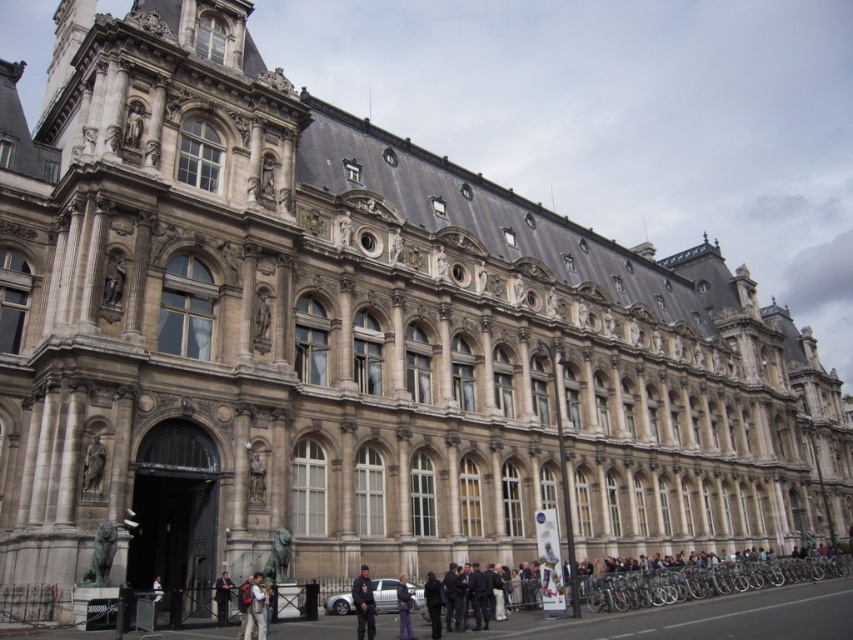
Does dark blue uniform at center have a greater height compared to dark gray uniform at lower center?

Yes, dark blue uniform at center is taller than dark gray uniform at lower center.

Locate an element on the screen. The image size is (853, 640). dark blue uniform at center is located at coordinates (363, 604).

Which is behind, point (363, 596) or point (158, 608)?

Point (158, 608)

This screenshot has width=853, height=640. I want to click on dark blue uniform at center, so click(x=363, y=604).

Can you confirm if polished bronze statue at lower left is shorter than dark gray uniform at lower center?

No, polished bronze statue at lower left is not shorter than dark gray uniform at lower center.

Is polished bronze statue at lower left to the right of dark gray uniform at lower center from the viewer's perspective?

No, polished bronze statue at lower left is not to the right of dark gray uniform at lower center.

Which is behind, point (82, 488) or point (152, 586)?

The point (152, 586) is more distant.

The image size is (853, 640). Find the location of `polished bronze statue at lower left`. polished bronze statue at lower left is located at coordinates (93, 465).

Does dark blue uniform at center have a greater height compared to dark gray jacket at center?

Yes, dark blue uniform at center is taller than dark gray jacket at center.

Is point (370, 627) farther from camera compared to point (218, 609)?

No, (370, 627) is closer to viewer.

Is point (366, 568) closer to camera compared to point (224, 572)?

No, (366, 568) is behind (224, 572).

Image resolution: width=853 pixels, height=640 pixels. In order to click on dark blue uniform at center in this screenshot , I will do `click(363, 604)`.